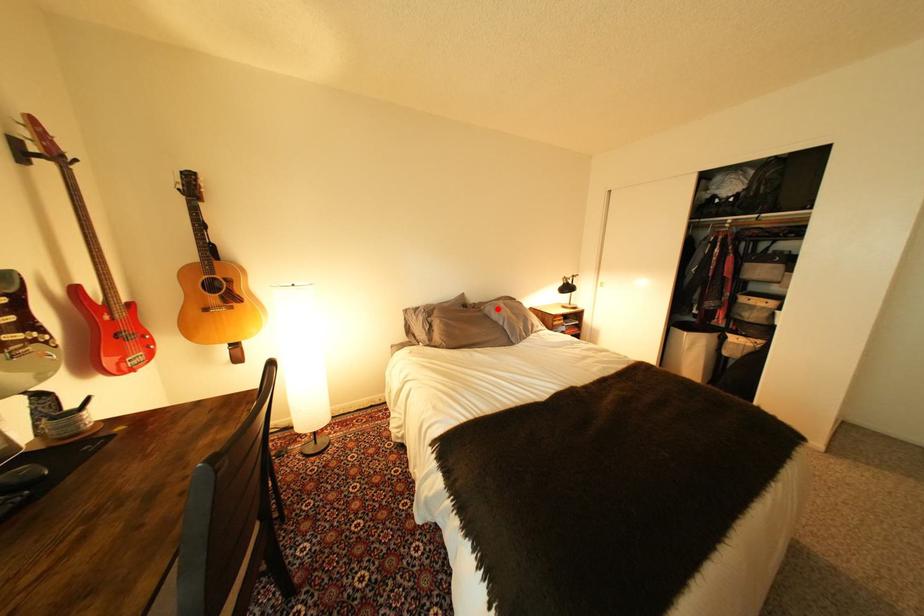
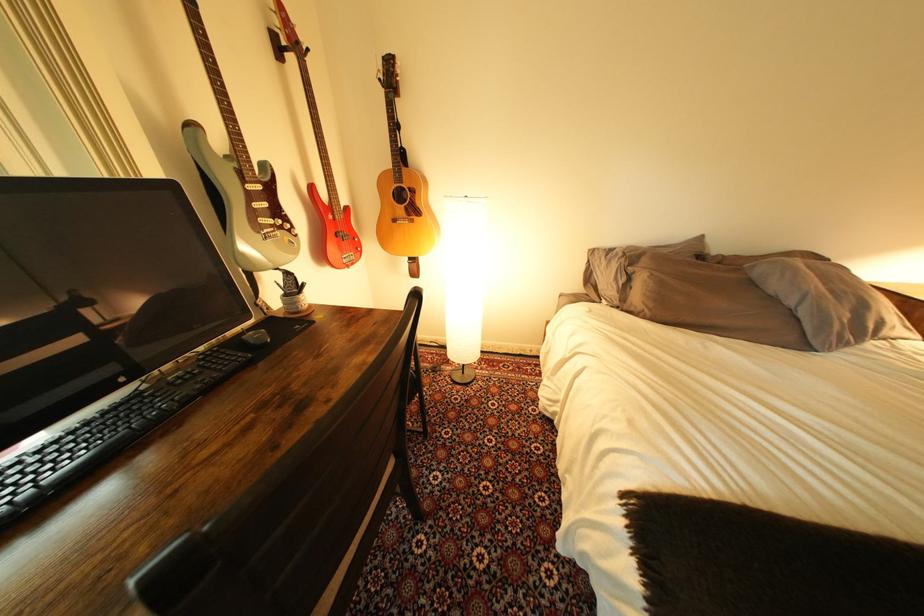
Find the pixel in the second image that matches the highlighted location in the first image.

(767, 268)